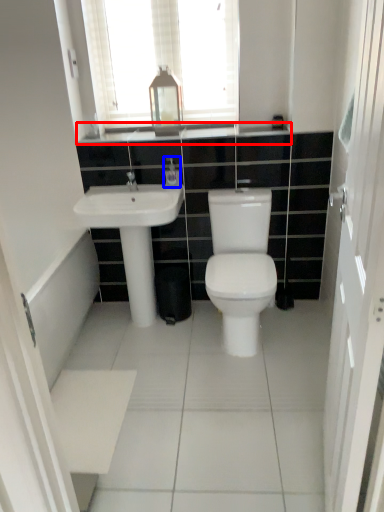
Question: Among these objects, which one is farthest to the camera, counter top (highlighted by a red box) or toiletry (highlighted by a blue box)?

Choices:
 (A) counter top
 (B) toiletry

Answer: (B)